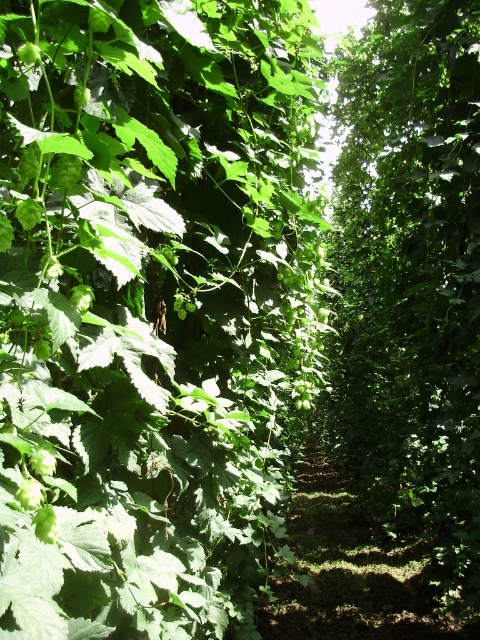
You are standing on the narrow pathway in the lush, verdant scene. You want to reach the green leafy plant at center. In which direction should you walk to get closer to it?

The green leafy plant at center is located at point 0.483 on the x axis and 0.317 on the y axis. Since the path is narrow and surrounded by dense foliage, you should walk forward along the path towards the center of the scene to reach the green leafy plant at center.

You are a hiker walking along the narrow path in the forest. You notice two green leafy plants ahead at the center of your view. One is labeled as the green leafy plant at center and the other as the green leafy tree at center. Which one is closer to you as you walk forward?

The green leafy plant at center is closer to you because it is positioned in front of the green leafy tree at center.

You are standing on the narrow pathway in the lush forest scene. There are two points marked on the path at coordinates point (142, 56) and point (342, 403). Which point is closer to you?

Point (142, 56) is closer to the viewer than point (342, 403).